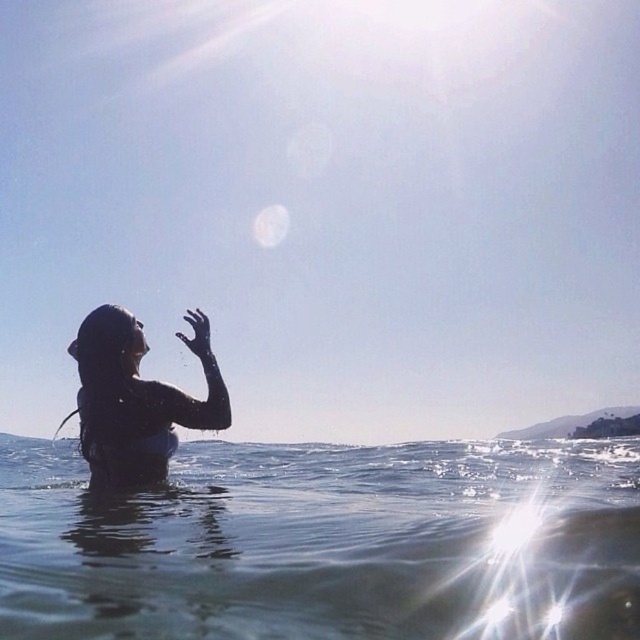
Based on the photo, you are standing at the edge of the water and want to touch the point marked as point [540,490] in the image. Considering the water is calm and your swimming ability, can you safely reach that point without wading too deep?

The point [540,490] is 5.74 meters from the viewer. Since the water is calm, you can safely swim to the point as long as you are comfortable in water up to that distance.

You are a photographer trying to capture the reflection of the sun on the water. The clear liquid water at center and wet hair at left are both in your frame. Since the water is narrower than the hair, which object would you focus on to ensure the reflection is properly captured?

The clear liquid water at center has a smaller width compared to the wet hair at left. To capture the reflection properly, focus on the clear liquid water at center since it is narrower and positioned centrally in the scene.